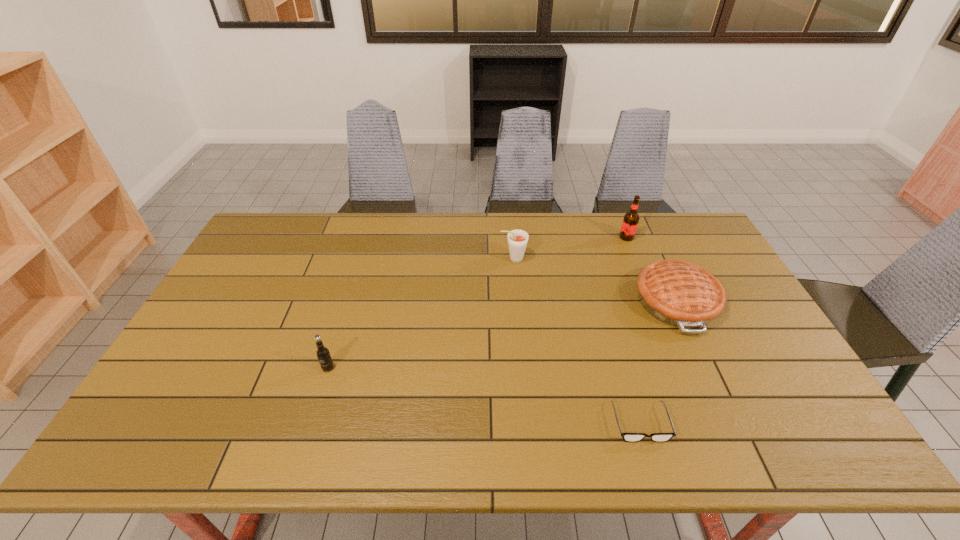
Locate an element on the screen. vacant space located on the left of the farthest object is located at coordinates (533, 237).

The image size is (960, 540). I want to click on vacant space located on the drink side of the second object from left to right, so click(387, 259).

This screenshot has height=540, width=960. I want to click on vacant space located 0.290m on the drink side of the second object from left to right, so click(x=414, y=259).

Identify the location of free location located 0.220m on the drink side of the second object from left to right. (434, 259).

Find the location of `vacant area located 0.110m on the label of the fourth farthest object`. vacant area located 0.110m on the label of the fourth farthest object is located at coordinates (315, 410).

Locate an element on the screen. This screenshot has width=960, height=540. blank space located on the front of the fourth tallest object is located at coordinates (711, 376).

Where is `object positioned at the near edge`? The image size is (960, 540). object positioned at the near edge is located at coordinates click(x=628, y=437).

Where is `object that is at the right edge`? This screenshot has width=960, height=540. object that is at the right edge is located at coordinates (675, 292).

Locate an element on the screen. vacant point at the far edge is located at coordinates (339, 243).

Image resolution: width=960 pixels, height=540 pixels. In the image, there is a desktop. In order to click on free region at the near edge in this screenshot , I will do `click(612, 428)`.